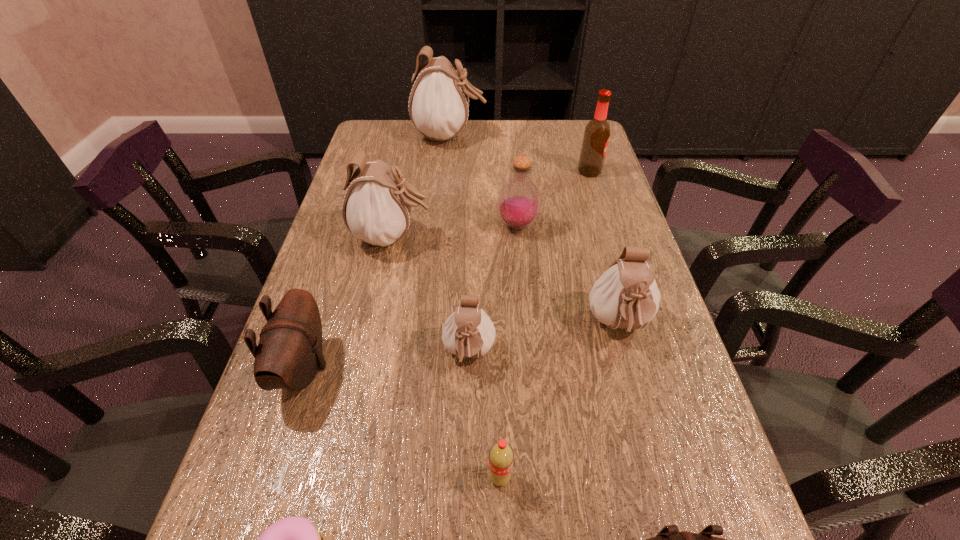
The image size is (960, 540). I want to click on the biggest white pouch, so click(438, 106).

Identify the location of the tallest pouch. (438, 106).

This screenshot has height=540, width=960. I want to click on beer bottle, so click(596, 136).

Where is `the fifth nearest pouch`? the fifth nearest pouch is located at coordinates (377, 206).

I want to click on the second tallest pouch, so click(x=377, y=206).

Find the location of a particular element. Image resolution: width=960 pixels, height=540 pixels. bottle is located at coordinates (519, 201).

Find the location of `the second smallest white pouch`. the second smallest white pouch is located at coordinates (626, 296).

At what (x,y) coordinates should I click in order to perform the action: click on the farther brown pouch. Please return your answer as a coordinate pair (x, y). This screenshot has width=960, height=540. Looking at the image, I should click on click(x=289, y=353).

This screenshot has height=540, width=960. Find the location of `the bigger brown pouch`. the bigger brown pouch is located at coordinates tap(289, 353).

The image size is (960, 540). In order to click on the smallest white pouch in this screenshot , I will do `click(468, 332)`.